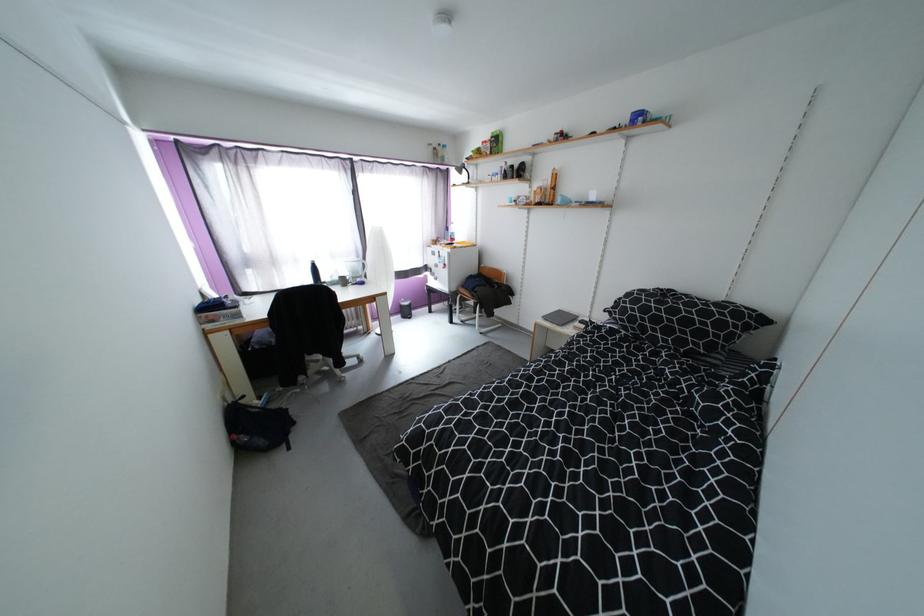
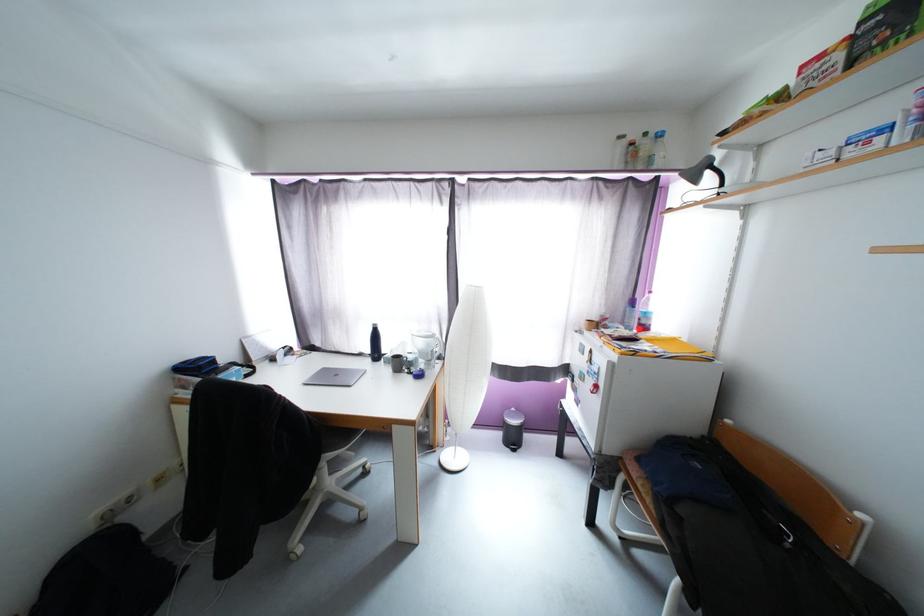
Locate, in the second image, the point that corresponds to [458,235] in the first image.

(651, 315)